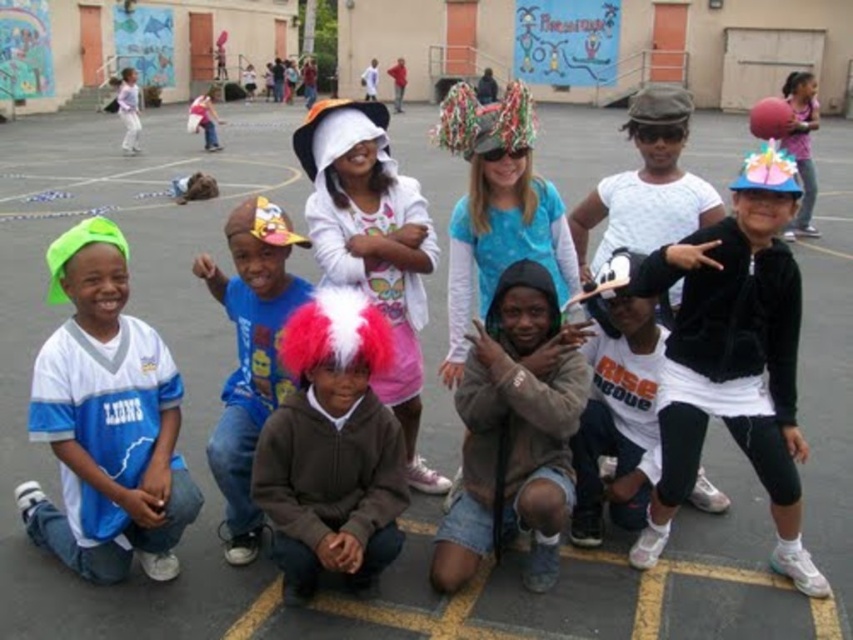
How much distance is there between neon green fabric hat at lower left and blue cotton shirt at center?

A distance of 27.24 inches exists between neon green fabric hat at lower left and blue cotton shirt at center.

Does neon green fabric hat at lower left have a smaller size compared to blue cotton shirt at center?

No.

Find the location of a particular element. The width and height of the screenshot is (853, 640). neon green fabric hat at lower left is located at coordinates (106, 420).

This screenshot has height=640, width=853. In order to click on neon green fabric hat at lower left in this screenshot , I will do `click(106, 420)`.

This screenshot has width=853, height=640. Describe the element at coordinates (250, 355) in the screenshot. I see `blue cotton shirt at center` at that location.

Is blue cotton shirt at center thinner than matte pink shirt at upper right?

Yes, blue cotton shirt at center is thinner than matte pink shirt at upper right.

Find the location of a particular element. This screenshot has width=853, height=640. blue cotton shirt at center is located at coordinates (250, 355).

Who is more distant from viewer, (675,349) or (693,493)?

The point (693,493) is behind.

Can you confirm if shiny black jacket at center right is bigger than white matte t-shirt at center?

Correct, shiny black jacket at center right is larger in size than white matte t-shirt at center.

Locate an element on the screen. The image size is (853, 640). shiny black jacket at center right is located at coordinates (734, 358).